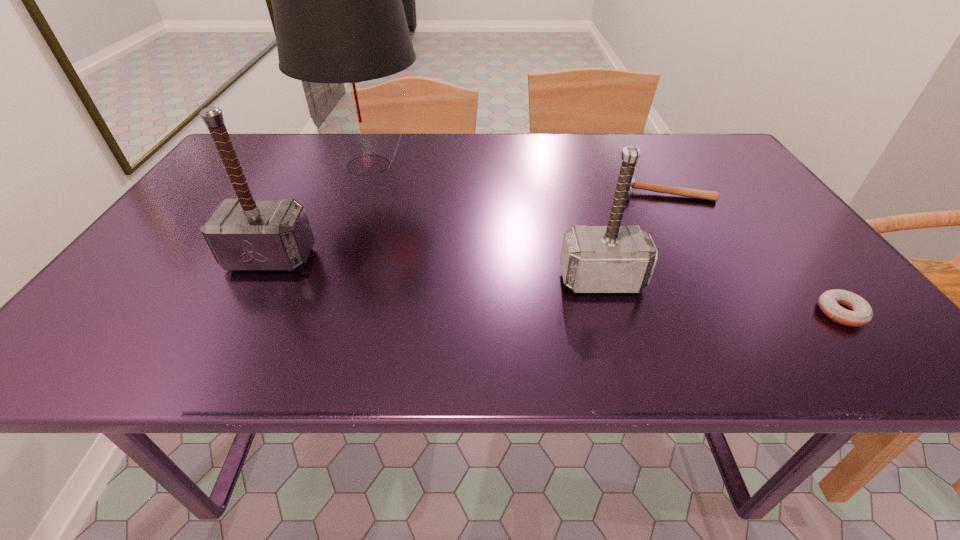
Where is `free point located on the left of the rightmost object`? Image resolution: width=960 pixels, height=540 pixels. free point located on the left of the rightmost object is located at coordinates (676, 313).

Where is `object present at the far edge`? Image resolution: width=960 pixels, height=540 pixels. object present at the far edge is located at coordinates (339, 20).

Locate an element on the screen. object located in the near edge section of the desktop is located at coordinates (860, 313).

What are the coordinates of `hammer at the right edge` in the screenshot? It's located at (693, 193).

The height and width of the screenshot is (540, 960). Find the location of `doughnut positioned at the right edge`. doughnut positioned at the right edge is located at coordinates (860, 313).

You are a GUI agent. You are given a task and a screenshot of the screen. Output one action in this format:
    pyautogui.click(x=<x>, y=<y>)
    Task: Click on the object positioned at the near right corner
    This screenshot has width=960, height=540.
    Given the screenshot: What is the action you would take?
    pyautogui.click(x=860, y=313)

Identify the location of vacant area at the far edge of the desktop. (434, 156).

This screenshot has height=540, width=960. Find the location of `vacant space at the left edge of the desktop`. vacant space at the left edge of the desktop is located at coordinates (166, 239).

Image resolution: width=960 pixels, height=540 pixels. In the image, there is a desktop. Identify the location of vacant region at the right edge. (735, 173).

Locate an element on the screen. This screenshot has height=540, width=960. vacant position at the far left corner of the desktop is located at coordinates (276, 151).